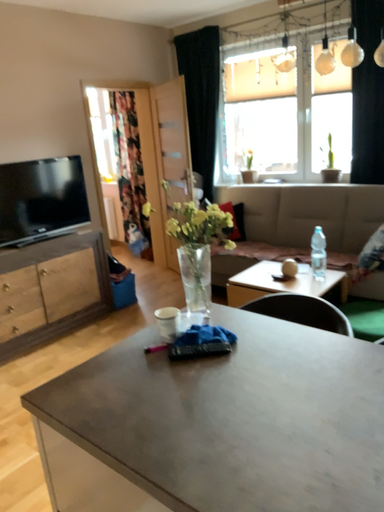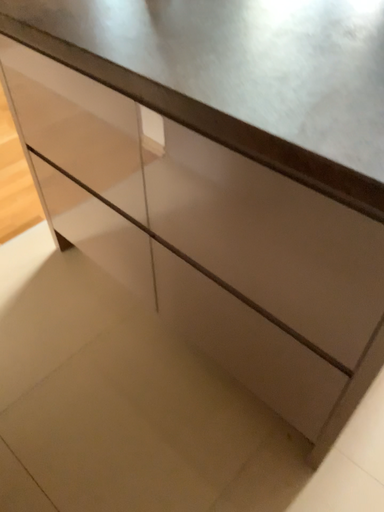
Question: How did the camera likely rotate when shooting the video?

Choices:
 (A) rotated downward
 (B) rotated upward

Answer: (A)